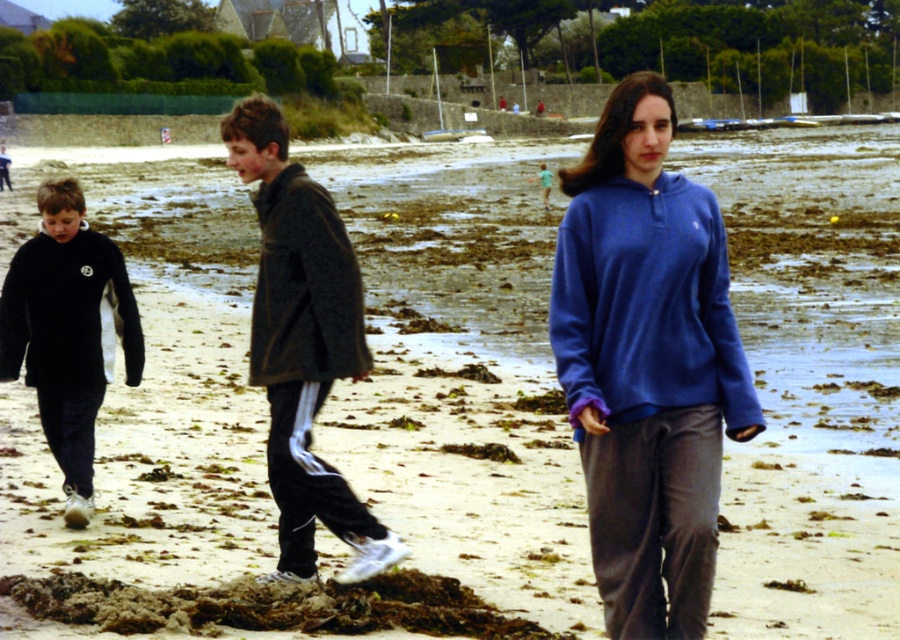
Does brown/muddy sand at lower left have a smaller size compared to black fleece sweatshirt at left?

Actually, brown/muddy sand at lower left might be larger than black fleece sweatshirt at left.

How much distance is there between brown/muddy sand at lower left and black fleece sweatshirt at left?

brown/muddy sand at lower left is 2.23 meters from black fleece sweatshirt at left.

You are a GUI agent. You are given a task and a screenshot of the screen. Output one action in this format:
    pyautogui.click(x=<x>, y=<y>)
    Task: Click on the brown/muddy sand at lower left
    
    Given the screenshot: What is the action you would take?
    pyautogui.click(x=273, y=605)

Where is `brown/muddy sand at lower left`? The width and height of the screenshot is (900, 640). brown/muddy sand at lower left is located at coordinates (273, 605).

Between black fleece jacket at left and dark gray fleece sweatshirt at center, which one appears on the left side from the viewer's perspective?

black fleece jacket at left

Between point (28, 385) and point (360, 280), which one is positioned behind?

Point (28, 385)

Is point (113, 292) closer to viewer compared to point (298, 326)?

No, (113, 292) is behind (298, 326).

Find the location of a particular element. The image size is (900, 640). black fleece jacket at left is located at coordinates (68, 332).

Does blue fleece sweatshirt at center have a lesser height compared to black fleece sweatshirt at left?

In fact, blue fleece sweatshirt at center may be taller than black fleece sweatshirt at left.

How much distance is there between blue fleece sweatshirt at center and black fleece sweatshirt at left?

The distance of blue fleece sweatshirt at center from black fleece sweatshirt at left is 4.04 meters.

Does point (698, 225) lie in front of point (123, 310)?

Yes, point (698, 225) is closer to viewer.

This screenshot has height=640, width=900. In order to click on blue fleece sweatshirt at center in this screenshot , I will do `click(646, 305)`.